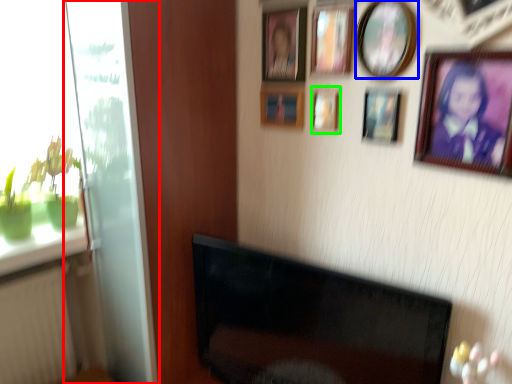
Question: Which object is the farthest from glass door (highlighted by a red box)? Choose among these: picture frame (highlighted by a blue box) or picture frame (highlighted by a green box).

Choices:
 (A) picture frame
 (B) picture frame

Answer: (A)